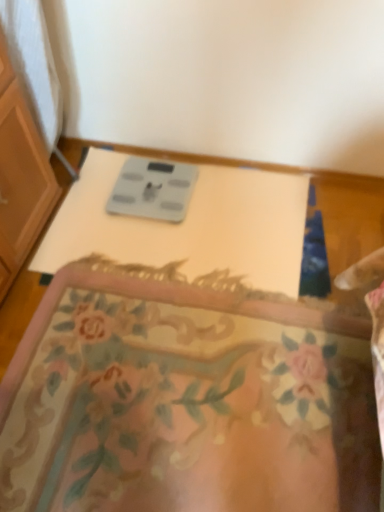
Locate an element on the screen. This screenshot has height=512, width=384. free space to the left of gray matte scale at center is located at coordinates (90, 206).